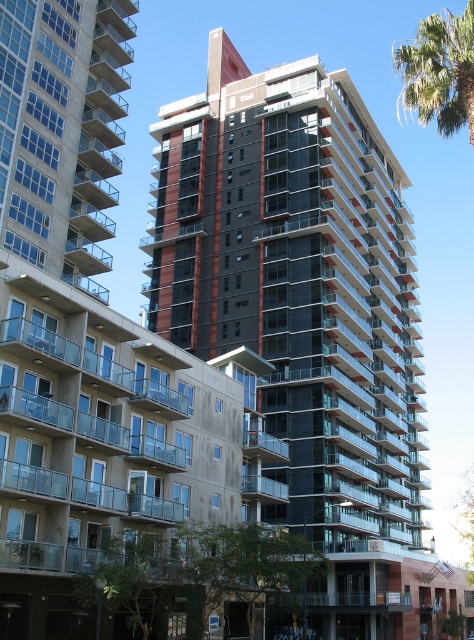
Question: Is dark glass building at center in front of green leafy palm tree at upper right?

Choices:
 (A) no
 (B) yes

Answer: (A)

Question: Which of the following is the closest to the observer?

Choices:
 (A) (149, 128)
 (B) (456, 88)

Answer: (B)

Question: Can you confirm if dark glass building at center is smaller than green leafy palm tree at upper right?

Choices:
 (A) no
 (B) yes

Answer: (B)

Question: Does dark glass building at center lie in front of green leafy palm tree at upper right?

Choices:
 (A) yes
 (B) no

Answer: (B)

Question: Which point is closer to the camera?

Choices:
 (A) green leafy palm tree at upper right
 (B) dark glass building at center

Answer: (A)